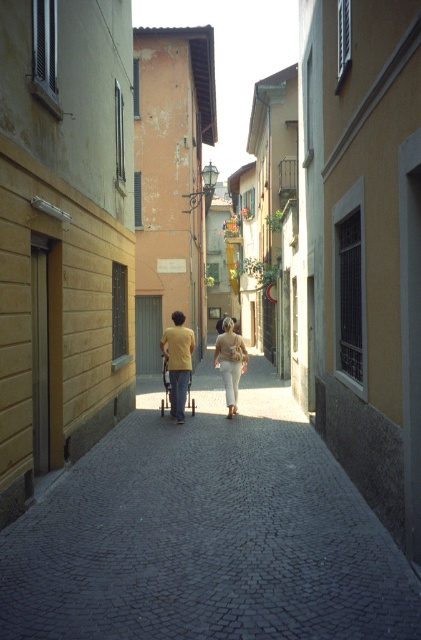
Consider the image. You are a passerby on the cobblestone street and you see a person wearing a yellow matte shirt at center and matte beige pants at center. Which piece of clothing is closer to the left side of the street?

The yellow matte shirt at center is closer to the left side of the street because it is positioned to the left of the matte beige pants at center.

You are a tourist walking down a narrow cobblestone street. You see a yellow cotton shirt at center. Where exactly is the yellow cotton shirt located in terms of coordinates?

The yellow cotton shirt at center is located at coordinates point [176,360].